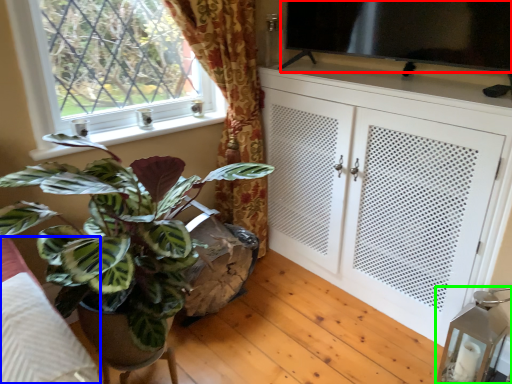
Question: Considering the real-world distances, which object is farthest from window screen (highlighted by a red box)? bedding (highlighted by a blue box) or lamp (highlighted by a green box)?

Choices:
 (A) bedding
 (B) lamp

Answer: (A)